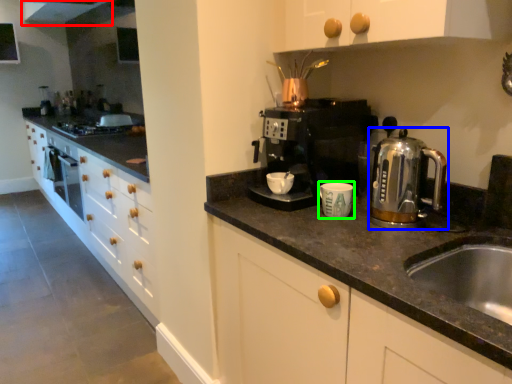
Question: Which object is the closest to the exhaust hood (highlighted by a red box)? Choose among these: home appliance (highlighted by a blue box) or kitchen appliance (highlighted by a green box).

Choices:
 (A) home appliance
 (B) kitchen appliance

Answer: (A)